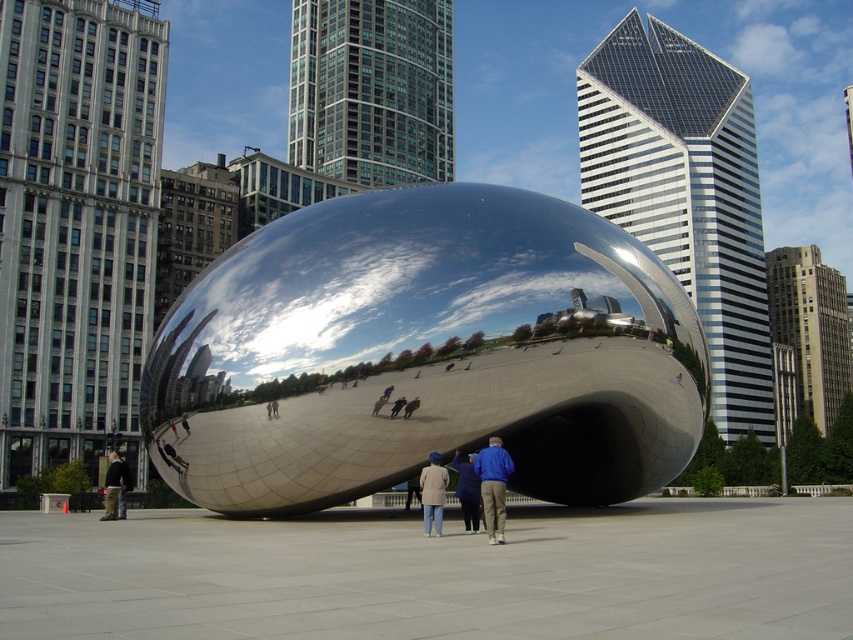
You are a photographer planning to take a picture of the blue denim jacket at center and the dark gray jacket at lower left. Which jacket should you focus on first if you want to capture both in a single frame without moving your camera? Explain your reasoning based on their positions.

The blue denim jacket at center is not as tall as the dark gray jacket at lower left. To capture both in a single frame without moving the camera, focus on the taller dark gray jacket at lower left first, ensuring it fits within the frame before adjusting for the shorter blue denim jacket at center.

You are standing in front of the Cloud Gate sculpture in Millennium Park and see the beige wool coat at center. If you want to find the exact location of the coat, what coordinates would you use?

The beige wool coat at center is located at coordinates point (432, 492).